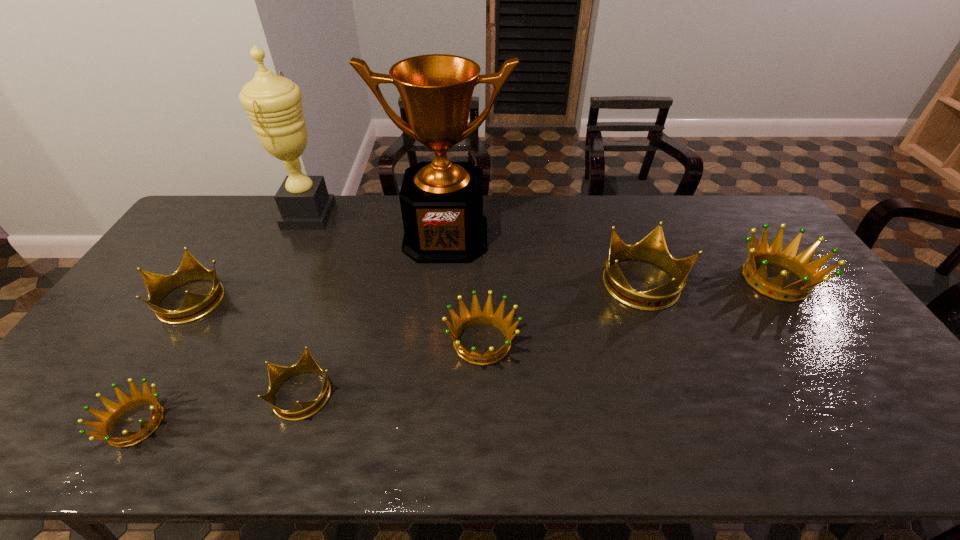
The height and width of the screenshot is (540, 960). I want to click on free location that satisfies the following two spatial constraints: 1. on the front of the gold trophy cup with the label; 2. on the right side of the second golden crown from left to right, so click(x=437, y=342).